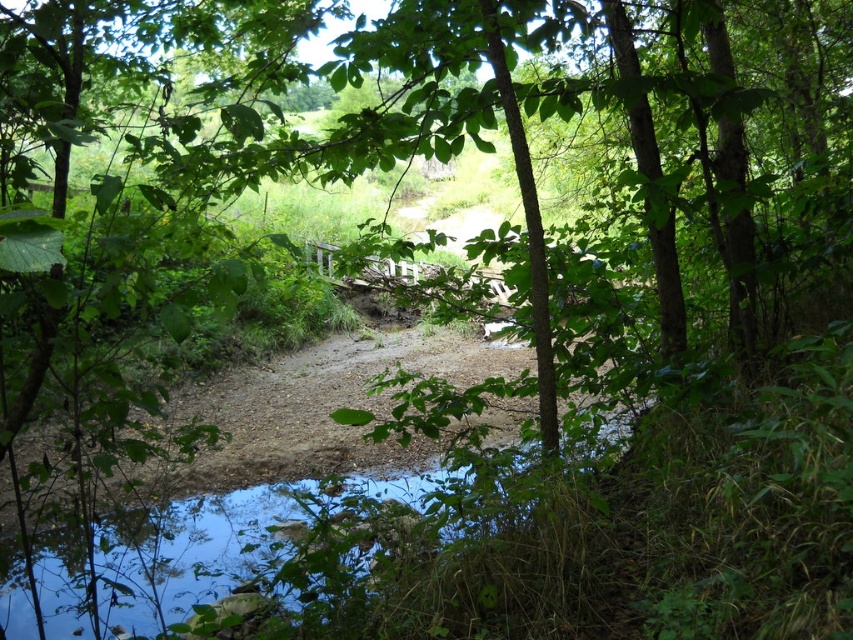
Question: Is brown gravel dirt track at center positioned in front of clear water at bottom?

Choices:
 (A) no
 (B) yes

Answer: (A)

Question: Does brown gravel dirt track at center come behind clear water at bottom?

Choices:
 (A) yes
 (B) no

Answer: (A)

Question: Which object is closer to the camera taking this photo?

Choices:
 (A) brown gravel dirt track at center
 (B) clear water at bottom

Answer: (B)

Question: Is brown gravel dirt track at center bigger than clear water at bottom?

Choices:
 (A) no
 (B) yes

Answer: (B)

Question: Which point is closer to the camera?

Choices:
 (A) brown gravel dirt track at center
 (B) clear water at bottom

Answer: (B)